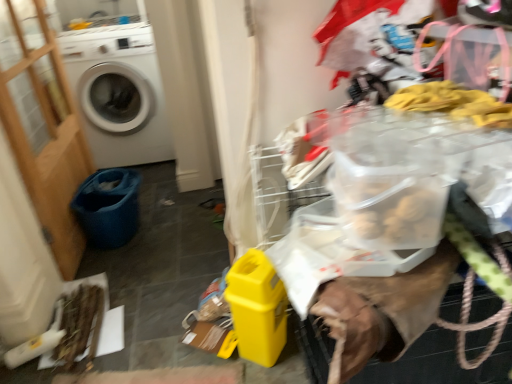
Question: Should I look upward or downward to see white matte washing machine at left?

Choices:
 (A) down
 (B) up

Answer: (B)

Question: From the image's perspective, is white matte washing machine at left above wooden screen door at left?

Choices:
 (A) yes
 (B) no

Answer: (A)

Question: Can you confirm if white matte washing machine at left is smaller than wooden screen door at left?

Choices:
 (A) yes
 (B) no

Answer: (B)

Question: Is white matte washing machine at left wider than wooden screen door at left?

Choices:
 (A) yes
 (B) no

Answer: (A)

Question: Is white matte washing machine at left further to the viewer compared to wooden screen door at left?

Choices:
 (A) yes
 (B) no

Answer: (A)

Question: Is white matte washing machine at left positioned far away from wooden screen door at left?

Choices:
 (A) no
 (B) yes

Answer: (A)

Question: Is white matte washing machine at left shorter than wooden screen door at left?

Choices:
 (A) yes
 (B) no

Answer: (A)

Question: From a real-world perspective, is blue fabric bucket at lower left below white matte washing machine at left?

Choices:
 (A) no
 (B) yes

Answer: (B)

Question: Is the position of blue fabric bucket at lower left more distant than that of white matte washing machine at left?

Choices:
 (A) no
 (B) yes

Answer: (A)

Question: Is blue fabric bucket at lower left smaller than white matte washing machine at left?

Choices:
 (A) no
 (B) yes

Answer: (B)

Question: Does blue fabric bucket at lower left have a lesser height compared to white matte washing machine at left?

Choices:
 (A) no
 (B) yes

Answer: (B)

Question: From a real-world perspective, is blue fabric bucket at lower left located higher than white matte washing machine at left?

Choices:
 (A) yes
 (B) no

Answer: (B)

Question: Is blue fabric bucket at lower left closer to the viewer compared to white matte washing machine at left?

Choices:
 (A) no
 (B) yes

Answer: (B)

Question: Is wooden screen door at left thinner than white matte washing machine at left?

Choices:
 (A) yes
 (B) no

Answer: (A)